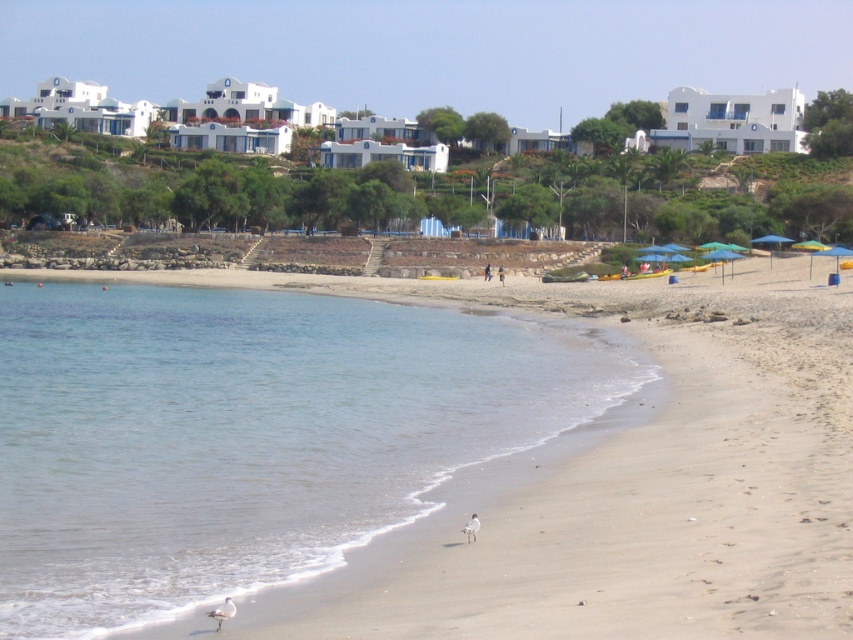
Question: Does white feathered bird at lower left have a smaller size compared to brown leather bag at center?

Choices:
 (A) no
 (B) yes

Answer: (B)

Question: Estimate the real-world distances between objects in this image. Which object is farther from the green fabric umbrella at right?

Choices:
 (A) white feathered bird at lower center
 (B) brown leather bag at center
 (C) dark blue jeans at center
 (D) white feathered bird at lower left

Answer: (D)

Question: Considering the real-world distances, which object is farthest from the clear blue water at lower left?

Choices:
 (A) dark blue jeans at center
 (B) white feathered bird at lower center

Answer: (A)

Question: Which point is closer to the camera taking this photo?

Choices:
 (A) (247, 544)
 (B) (764, 236)
 (C) (486, 273)

Answer: (A)

Question: Can you confirm if green fabric umbrella at right is positioned below white feathered bird at lower center?

Choices:
 (A) yes
 (B) no

Answer: (B)

Question: Considering the relative positions of clear blue water at lower left and dark blue jeans at center in the image provided, where is clear blue water at lower left located with respect to dark blue jeans at center?

Choices:
 (A) right
 (B) left

Answer: (B)